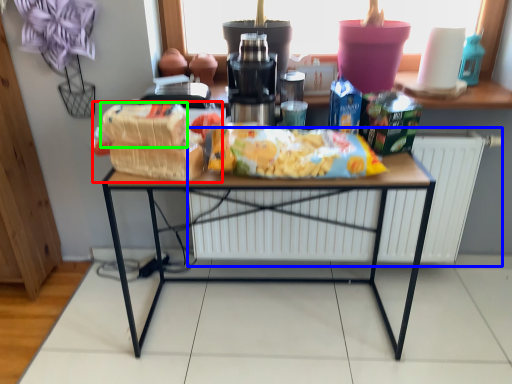
Question: Which object is positioned farthest from snack (highlighted by a red box)? Select from radiator (highlighted by a blue box) and cereal (highlighted by a green box).

Choices:
 (A) radiator
 (B) cereal

Answer: (A)